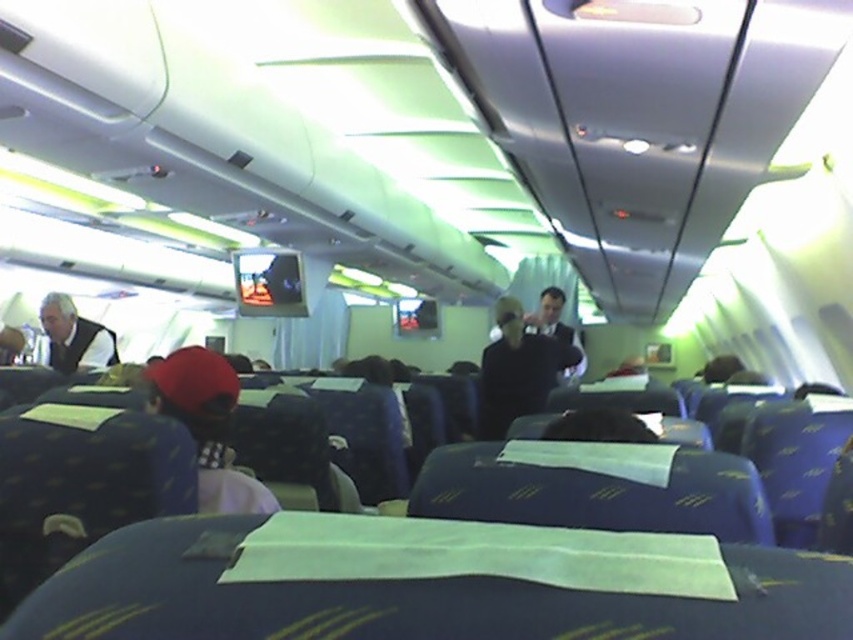
Question: Which point is farther to the camera?

Choices:
 (A) white shirt at left
 (B) red fabric cap at left

Answer: (A)

Question: Which object is farther from the camera taking this photo?

Choices:
 (A) red fabric cap at left
 (B) dark blue suit at center

Answer: (B)

Question: Can you confirm if dark blue fabric jacket at center is positioned above white shirt at left?

Choices:
 (A) yes
 (B) no

Answer: (B)

Question: Can you confirm if red fabric cap at left is positioned below white shirt at left?

Choices:
 (A) yes
 (B) no

Answer: (A)

Question: Can you confirm if red fabric cap at left is positioned to the right of white shirt at left?

Choices:
 (A) no
 (B) yes

Answer: (B)

Question: Among these objects, which one is farthest from the camera?

Choices:
 (A) dark blue fabric jacket at center
 (B) red fabric cap at left
 (C) dark blue suit at center
 (D) white shirt at left

Answer: (C)